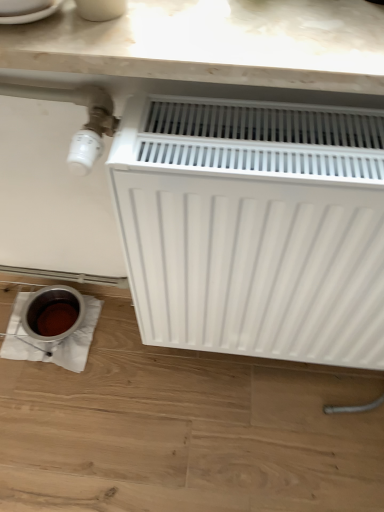
The image size is (384, 512). I want to click on white marble countertop at upper center, so click(x=214, y=42).

In order to face white marble countertop at upper center, should I rotate leftwards or rightwards?

Turn right by 0.291 degrees to look at white marble countertop at upper center.

What is the approximate height of white marble countertop at upper center?

white marble countertop at upper center is 2.23 inches tall.

Describe the element at coordinates (214, 42) in the screenshot. The width and height of the screenshot is (384, 512). I see `white marble countertop at upper center` at that location.

Locate an element on the screen. Image resolution: width=384 pixels, height=512 pixels. white matte radiator at center is located at coordinates pyautogui.click(x=254, y=227).

This screenshot has height=512, width=384. What do you see at coordinates (254, 227) in the screenshot?
I see `white matte radiator at center` at bounding box center [254, 227].

Locate an element on the screen. white marble countertop at upper center is located at coordinates (214, 42).

Can you confirm if white matte radiator at center is positioned to the left of white marble countertop at upper center?

In fact, white matte radiator at center is to the right of white marble countertop at upper center.

Is white matte radiator at center further to the viewer compared to white marble countertop at upper center?

No, white matte radiator at center is closer to the camera.

Is point (209, 148) less distant than point (155, 74)?

No, it is behind (155, 74).

From the image's perspective, which one is positioned lower, white matte radiator at center or white marble countertop at upper center?

white matte radiator at center, from the image's perspective.

From a real-world perspective, is white matte radiator at center physically below white marble countertop at upper center?

Correct, in the physical world, white matte radiator at center is lower than white marble countertop at upper center.

Considering the relative sizes of white matte radiator at center and white marble countertop at upper center in the image provided, is white matte radiator at center wider than white marble countertop at upper center?

No, white matte radiator at center is not wider than white marble countertop at upper center.

Considering the sizes of white matte radiator at center and white marble countertop at upper center in the image, is white matte radiator at center taller or shorter than white marble countertop at upper center?

Clearly, white matte radiator at center is taller compared to white marble countertop at upper center.

Between white matte radiator at center and white marble countertop at upper center, which one has smaller size?

With smaller size is white marble countertop at upper center.

Is white matte radiator at center located outside white marble countertop at upper center?

Indeed, white matte radiator at center is completely outside white marble countertop at upper center.

Is white matte radiator at center not near white marble countertop at upper center?

white matte radiator at center is actually quite close to white marble countertop at upper center.

Is white matte radiator at center facing towards white marble countertop at upper center?

No, white matte radiator at center is not aimed at white marble countertop at upper center.

Measure the distance between white matte radiator at center and white marble countertop at upper center.

white matte radiator at center is 8.02 inches away from white marble countertop at upper center.

Identify the location of counter top above the white matte radiator at center (from a real-world perspective). (214, 42).

Can you confirm if white marble countertop at upper center is positioned to the right of white matte radiator at center?

No.

Which is behind, white marble countertop at upper center or white matte radiator at center?

white marble countertop at upper center is behind.

Which is nearer, [204,37] or [261,277]?

The point [204,37] is more forward.

From the image's perspective, relative to white matte radiator at center, is white marble countertop at upper center above or below?

white marble countertop at upper center is situated higher than white matte radiator at center in the image.

From a real-world perspective, is white marble countertop at upper center positioned under white matte radiator at center based on gravity?

No, from a real-world perspective, white marble countertop at upper center is not under white matte radiator at center.

Looking at this image, can you confirm if white marble countertop at upper center is wider than white matte radiator at center?

Yes.

From their relative heights in the image, would you say white marble countertop at upper center is taller or shorter than white matte radiator at center?

Considering their sizes, white marble countertop at upper center has less height than white matte radiator at center.

Considering the relative sizes of white marble countertop at upper center and white matte radiator at center in the image provided, is white marble countertop at upper center bigger than white matte radiator at center?

Incorrect, white marble countertop at upper center is not larger than white matte radiator at center.

Choose the correct answer: Is white marble countertop at upper center inside white matte radiator at center or outside it?

white marble countertop at upper center lies outside white matte radiator at center.

Are white marble countertop at upper center and white matte radiator at center far apart?

white marble countertop at upper center is actually quite close to white matte radiator at center.

Could you tell me if white marble countertop at upper center is facing white matte radiator at center?

No, white marble countertop at upper center does not turn towards white matte radiator at center.

Can you tell me how much white marble countertop at upper center and white matte radiator at center differ in facing direction?

The angular difference between white marble countertop at upper center and white matte radiator at center is 0.608 degrees.

Where is `radiator lying on the right of white marble countertop at upper center`? radiator lying on the right of white marble countertop at upper center is located at coordinates (254, 227).

The height and width of the screenshot is (512, 384). I want to click on radiator on the right side of white marble countertop at upper center, so click(x=254, y=227).

This screenshot has height=512, width=384. What are the coordinates of `radiator in front of the white marble countertop at upper center` in the screenshot? It's located at (254, 227).